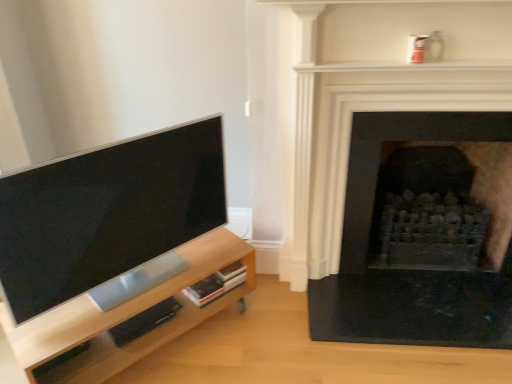
At what (x,y) coordinates should I click in order to perform the action: click on black stone fireplace at right, the second fireplace positioned from the front. Please return your answer as a coordinate pair (x, y). This screenshot has width=512, height=384. Looking at the image, I should click on (403, 138).

What do you see at coordinates (125, 317) in the screenshot? I see `light wood entertainment center at left` at bounding box center [125, 317].

This screenshot has width=512, height=384. Identify the location of black stone fireplace at right, which appears as the 1th fireplace when viewed from the front. (397, 169).

The image size is (512, 384). I want to click on matte black tv at left, so click(106, 213).

Can you confirm if light wood entertainment center at left is thinner than black stone fireplace at right, the second fireplace positioned from the front?

Yes, light wood entertainment center at left is thinner than black stone fireplace at right, the second fireplace positioned from the front.

What's the angular difference between light wood entertainment center at left and black stone fireplace at right, the second fireplace positioned from the front,'s facing directions?

The angle between the facing direction of light wood entertainment center at left and the facing direction of black stone fireplace at right, the second fireplace positioned from the front, is 46.4 degrees.

Looking at this image, is light wood entertainment center at left further to the viewer compared to black stone fireplace at right, the second fireplace positioned from the front?

No, it is in front of black stone fireplace at right, the second fireplace positioned from the front.

Between light wood entertainment center at left and black stone fireplace at right, the first fireplace positioned from the back, which one has more height?

black stone fireplace at right, the first fireplace positioned from the back.

Based on the photo, from the image's perspective, is black stone fireplace at right, which appears as the 1th fireplace when viewed from the front, below black stone fireplace at right, the second fireplace positioned from the front?

No.

Would you say black stone fireplace at right, which appears as the 1th fireplace when viewed from the front, contains black stone fireplace at right, the second fireplace positioned from the front?

No, black stone fireplace at right, the second fireplace positioned from the front, is not surrounded by black stone fireplace at right, which appears as the 1th fireplace when viewed from the front.

Is black stone fireplace at right, marked as the 2th fireplace in a back-to-front arrangement, bigger or smaller than black stone fireplace at right, the second fireplace positioned from the front?

In the image, black stone fireplace at right, marked as the 2th fireplace in a back-to-front arrangement, appears to be smaller than black stone fireplace at right, the second fireplace positioned from the front.

From a real-world perspective, which is physically below, light wood entertainment center at left or black stone fireplace at right, marked as the 2th fireplace in a back-to-front arrangement?

In real-world perspective, light wood entertainment center at left is lower.

How different are the orientations of light wood entertainment center at left and black stone fireplace at right, marked as the 2th fireplace in a back-to-front arrangement, in degrees?

45.6 degrees separate the facing orientations of light wood entertainment center at left and black stone fireplace at right, marked as the 2th fireplace in a back-to-front arrangement.

Considering the sizes of objects light wood entertainment center at left and black stone fireplace at right, which appears as the 1th fireplace when viewed from the front, in the image provided, who is taller, light wood entertainment center at left or black stone fireplace at right, which appears as the 1th fireplace when viewed from the front,?

black stone fireplace at right, which appears as the 1th fireplace when viewed from the front.

Consider the image. Is light wood entertainment center at left looking in the opposite direction of black stone fireplace at right, marked as the 2th fireplace in a back-to-front arrangement?

No, light wood entertainment center at left is not facing away from black stone fireplace at right, marked as the 2th fireplace in a back-to-front arrangement.

Would you consider black stone fireplace at right, the first fireplace positioned from the back, to be distant from light wood entertainment center at left?

Actually, black stone fireplace at right, the first fireplace positioned from the back, and light wood entertainment center at left are a little close together.

Is light wood entertainment center at left completely or partially inside black stone fireplace at right, the first fireplace positioned from the back?

No, light wood entertainment center at left is not surrounded by black stone fireplace at right, the first fireplace positioned from the back.

From a real-world perspective, which object stands above the other?

black stone fireplace at right, the first fireplace positioned from the back, is physically above.

Which object is thinner, black stone fireplace at right, the first fireplace positioned from the back, or light wood entertainment center at left?

With smaller width is light wood entertainment center at left.

Locate an element on the screen. The height and width of the screenshot is (384, 512). television in front of the light wood entertainment center at left is located at coordinates (106, 213).

Considering the sizes of light wood entertainment center at left and matte black tv at left in the image, is light wood entertainment center at left taller or shorter than matte black tv at left?

Clearly, light wood entertainment center at left is shorter compared to matte black tv at left.

In the scene shown: Which of these two, light wood entertainment center at left or matte black tv at left, is wider?

With larger width is light wood entertainment center at left.

Does point (472, 135) come in front of point (402, 31)?

No, it is not.

Consider the image. How much distance is there between black stone fireplace at right, the second fireplace positioned from the front, and black stone fireplace at right, which appears as the 1th fireplace when viewed from the front?

They are 8.01 inches apart.

Does black stone fireplace at right, the first fireplace positioned from the back, have a smaller size compared to black stone fireplace at right, marked as the 2th fireplace in a back-to-front arrangement?

No.

Is black stone fireplace at right, the first fireplace positioned from the back, spatially inside black stone fireplace at right, which appears as the 1th fireplace when viewed from the front, or outside of it?

black stone fireplace at right, the first fireplace positioned from the back, is located beyond the bounds of black stone fireplace at right, which appears as the 1th fireplace when viewed from the front.

Does black stone fireplace at right, the first fireplace positioned from the back, appear on the left side of matte black tv at left?

In fact, black stone fireplace at right, the first fireplace positioned from the back, is to the right of matte black tv at left.

Based on the photo, would you say black stone fireplace at right, the second fireplace positioned from the front, contains matte black tv at left?

No.

In terms of height, does black stone fireplace at right, the second fireplace positioned from the front, look taller or shorter compared to matte black tv at left?

Considering their sizes, black stone fireplace at right, the second fireplace positioned from the front, has more height than matte black tv at left.

From the image's perspective, is black stone fireplace at right, the first fireplace positioned from the back, located above matte black tv at left?

Indeed, from the image's perspective, black stone fireplace at right, the first fireplace positioned from the back, is shown above matte black tv at left.

The width and height of the screenshot is (512, 384). I want to click on the 2nd fireplace to the right of the light wood entertainment center at left, starting your count from the anchor, so click(403, 138).

In the image, there is a black stone fireplace at right, which appears as the 1th fireplace when viewed from the front. Where is `fireplace below it (from the image's perspective)`? Image resolution: width=512 pixels, height=384 pixels. fireplace below it (from the image's perspective) is located at coordinates (403, 138).

Estimate the real-world distances between objects in this image. Which object is closer to black stone fireplace at right, which appears as the 1th fireplace when viewed from the front, light wood entertainment center at left or matte black tv at left?

matte black tv at left lies closer to black stone fireplace at right, which appears as the 1th fireplace when viewed from the front, than the other object.

Which object lies nearer to the anchor point black stone fireplace at right, the first fireplace positioned from the back, matte black tv at left or black stone fireplace at right, marked as the 2th fireplace in a back-to-front arrangement?

black stone fireplace at right, marked as the 2th fireplace in a back-to-front arrangement.

Based on their spatial positions, is black stone fireplace at right, the first fireplace positioned from the back, or light wood entertainment center at left further from black stone fireplace at right, which appears as the 1th fireplace when viewed from the front?

light wood entertainment center at left is further to black stone fireplace at right, which appears as the 1th fireplace when viewed from the front.

From the image, which object appears to be farther from black stone fireplace at right, the second fireplace positioned from the front, light wood entertainment center at left or matte black tv at left?

Based on the image, matte black tv at left appears to be further to black stone fireplace at right, the second fireplace positioned from the front.

Estimate the real-world distances between objects in this image. Which object is closer to matte black tv at left, light wood entertainment center at left or black stone fireplace at right, the first fireplace positioned from the back?

light wood entertainment center at left.

From the image, which object appears to be nearer to light wood entertainment center at left, black stone fireplace at right, marked as the 2th fireplace in a back-to-front arrangement, or black stone fireplace at right, the first fireplace positioned from the back?

black stone fireplace at right, marked as the 2th fireplace in a back-to-front arrangement.

Considering their positions, is light wood entertainment center at left positioned further to black stone fireplace at right, marked as the 2th fireplace in a back-to-front arrangement, than black stone fireplace at right, the first fireplace positioned from the back?

light wood entertainment center at left is further to black stone fireplace at right, marked as the 2th fireplace in a back-to-front arrangement.

Considering their positions, is matte black tv at left positioned further to black stone fireplace at right, the first fireplace positioned from the back, than light wood entertainment center at left?

Based on the image, matte black tv at left appears to be further to black stone fireplace at right, the first fireplace positioned from the back.

Where is `fireplace between light wood entertainment center at left and black stone fireplace at right, the first fireplace positioned from the back, from left to right`? This screenshot has height=384, width=512. fireplace between light wood entertainment center at left and black stone fireplace at right, the first fireplace positioned from the back, from left to right is located at coordinates (397, 169).

You are a GUI agent. You are given a task and a screenshot of the screen. Output one action in this format:
    pyautogui.click(x=<x>, y=<y>)
    Task: Click on the television between light wood entertainment center at left and black stone fireplace at right, the first fireplace positioned from the back, from left to right
    The height and width of the screenshot is (384, 512).
    Given the screenshot: What is the action you would take?
    pyautogui.click(x=106, y=213)

Where is `television between light wood entertainment center at left and black stone fireplace at right, which appears as the 1th fireplace when viewed from the front, in the horizontal direction`? television between light wood entertainment center at left and black stone fireplace at right, which appears as the 1th fireplace when viewed from the front, in the horizontal direction is located at coordinates (106, 213).

Identify the location of fireplace between matte black tv at left and black stone fireplace at right, the second fireplace positioned from the front, in the horizontal direction. (397, 169).